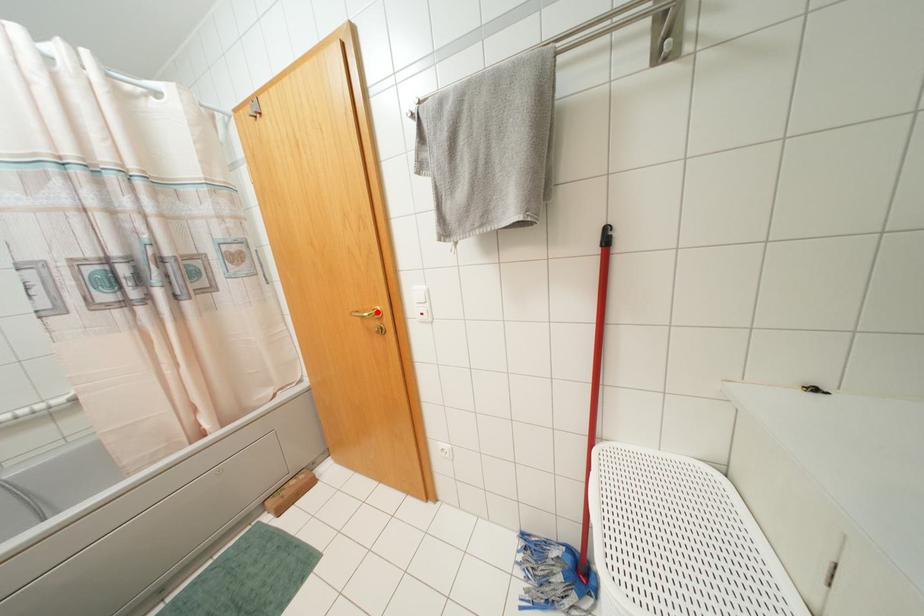
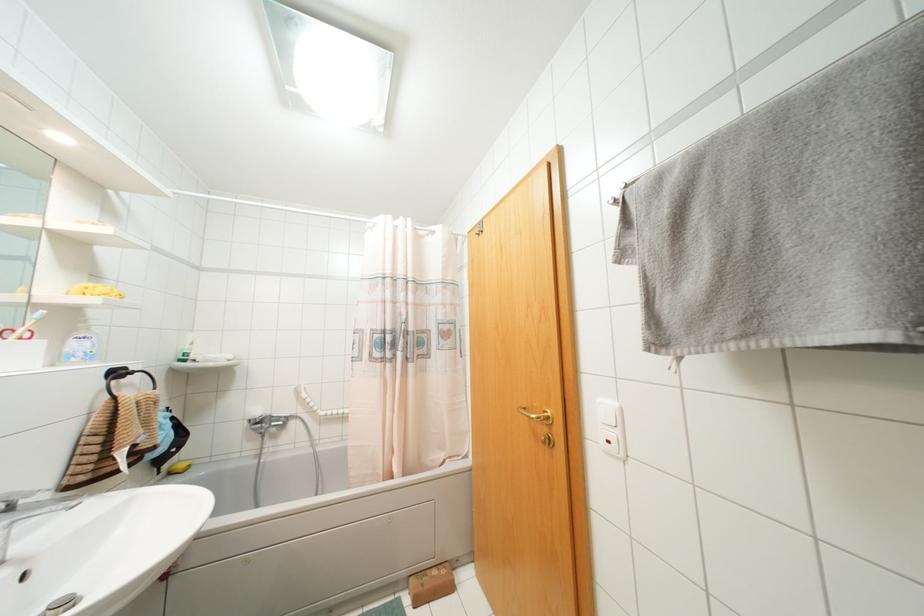
Find the pixel in the second image that matches the highlighted location in the first image.

(546, 416)